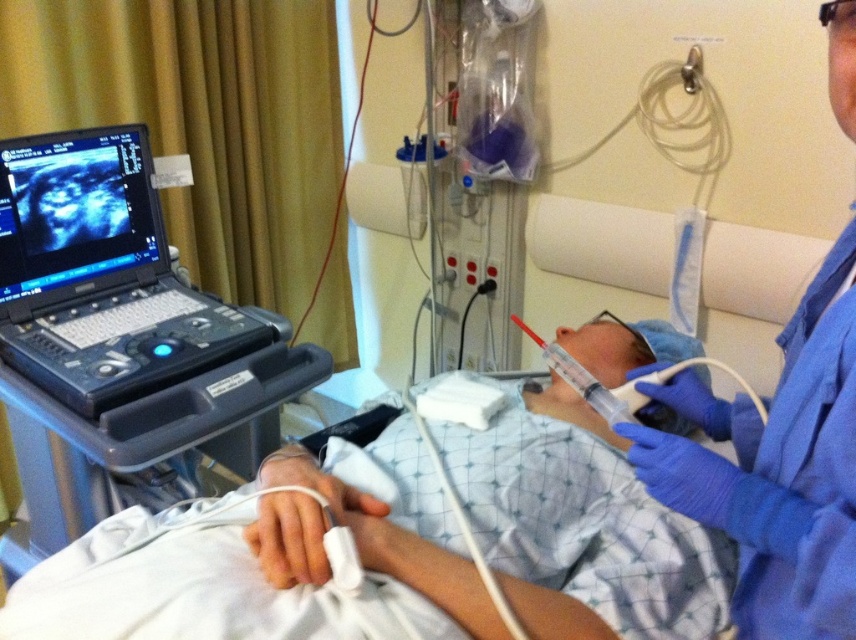
Question: Which of the following is the closest to the observer?

Choices:
 (A) (80, 193)
 (B) (275, 316)
 (C) (841, 42)

Answer: (C)

Question: Which is nearer to the matte black monitor at upper left?

Choices:
 (A) blue latex gloves at upper right
 (B) black plastic laptop at upper left

Answer: (B)

Question: Can you confirm if black plastic laptop at upper left is smaller than matte black monitor at upper left?

Choices:
 (A) no
 (B) yes

Answer: (A)

Question: Can you confirm if black plastic laptop at upper left is wider than matte black monitor at upper left?

Choices:
 (A) yes
 (B) no

Answer: (A)

Question: Which point is closer to the camera?

Choices:
 (A) (28, 145)
 (B) (48, 148)
 (C) (803, 461)

Answer: (C)

Question: Is black plastic laptop at upper left to the left of matte black monitor at upper left from the viewer's perspective?

Choices:
 (A) no
 (B) yes

Answer: (A)